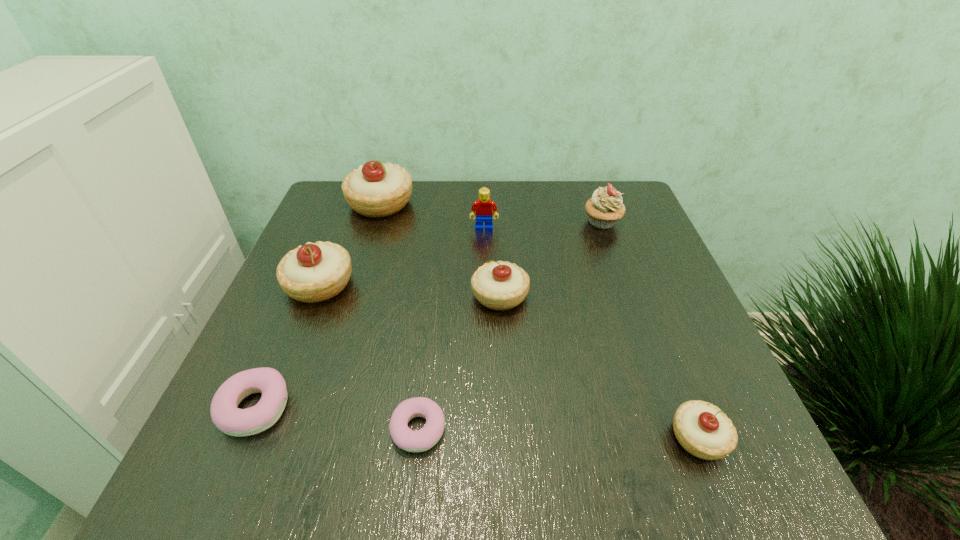
Find the location of `the tallest pastry`. the tallest pastry is located at coordinates (375, 189).

I want to click on the biggest beige pastry, so click(x=375, y=189).

Identify the location of cupcake. tap(605, 208).

You are a GUI agent. You are given a task and a screenshot of the screen. Output one action in this format:
    pyautogui.click(x=<x>, y=<y>)
    Task: Click on the Lego
    The height and width of the screenshot is (540, 960).
    Given the screenshot: What is the action you would take?
    pyautogui.click(x=482, y=208)

Where is `the third smallest beige pastry`? the third smallest beige pastry is located at coordinates (315, 272).

You are a GUI agent. You are given a task and a screenshot of the screen. Output one action in this format:
    pyautogui.click(x=<x>, y=<y>)
    Task: Click on the third tallest pastry
    
    Given the screenshot: What is the action you would take?
    pyautogui.click(x=499, y=285)

At what (x,y) coordinates should I click in order to perform the action: click on the third biggest beige pastry. Please return your answer as a coordinate pair (x, y). Looking at the image, I should click on (499, 285).

Locate an element on the screen. The height and width of the screenshot is (540, 960). the smallest beige pastry is located at coordinates (702, 429).

Locate an element on the screen. the rightmost beige pastry is located at coordinates tap(702, 429).

The width and height of the screenshot is (960, 540). Find the location of `the bigger pink pastry`. the bigger pink pastry is located at coordinates (231, 420).